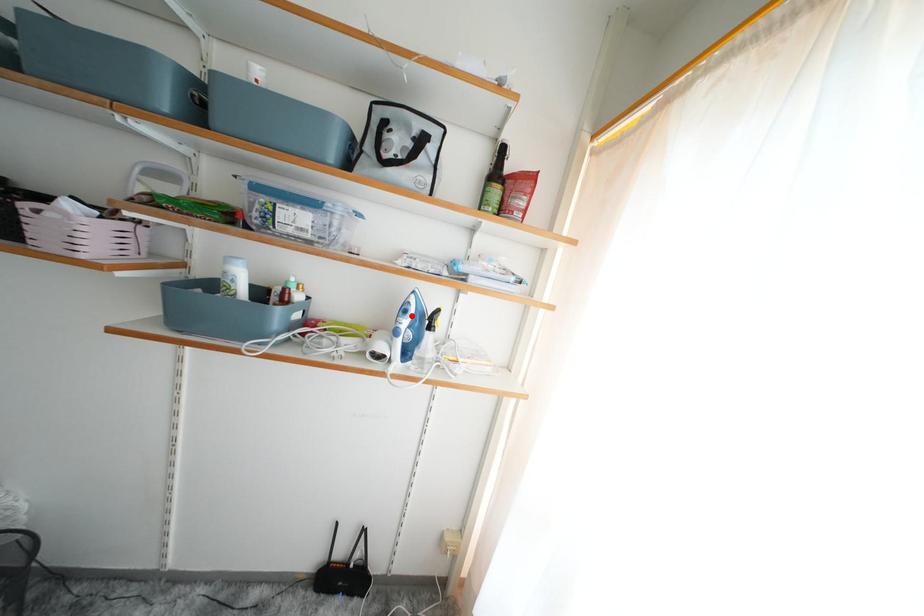
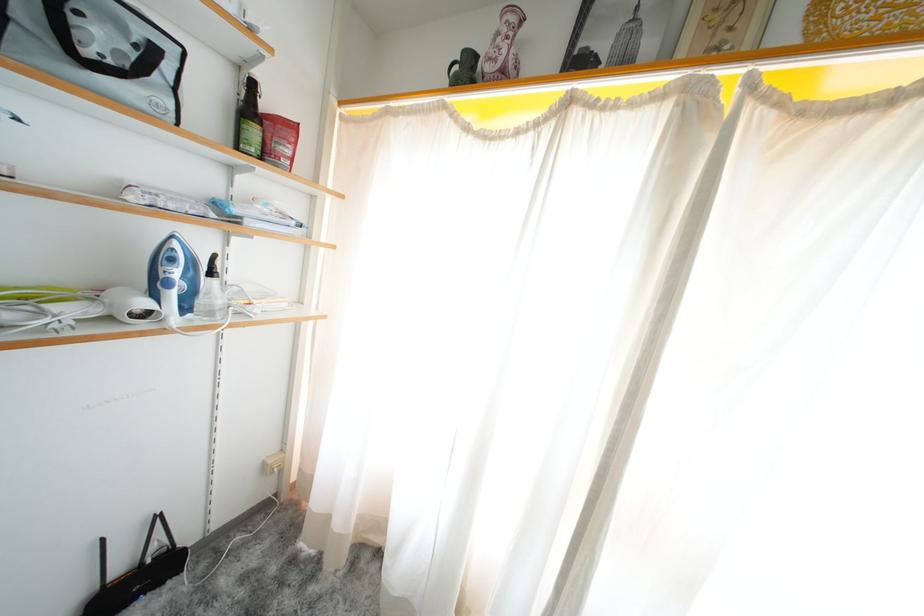
Find the pixel in the second image that matches the highlighted location in the first image.

(178, 264)